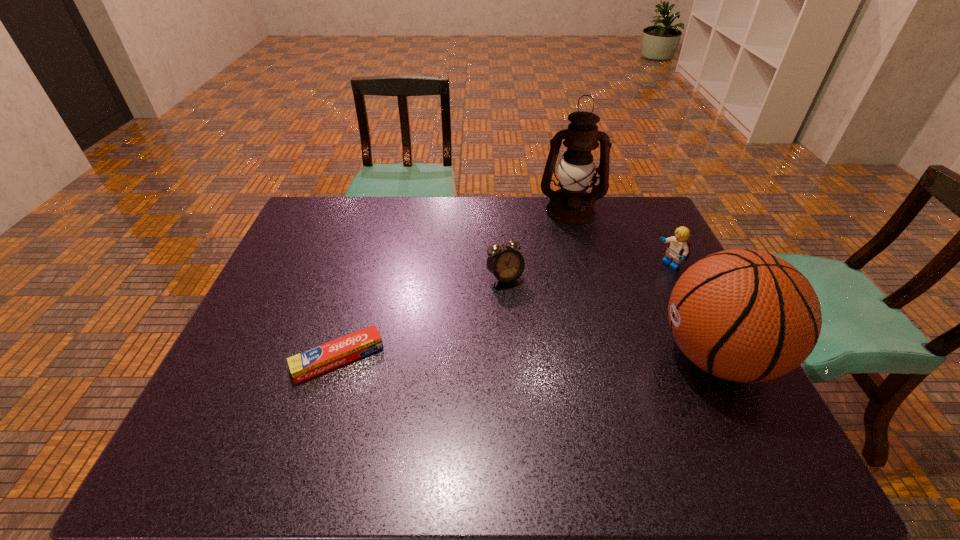
At what (x,y) coordinates should I click in order to perform the action: click on vacant region at the far left corner of the desktop. Please return your answer as a coordinate pair (x, y). The image size is (960, 540). Looking at the image, I should click on (323, 200).

The width and height of the screenshot is (960, 540). Identify the location of unoccupied position between the shortest object and the Lego. (503, 311).

Where is `free area in between the leftmost object and the Lego`? The image size is (960, 540). free area in between the leftmost object and the Lego is located at coordinates (503, 311).

Where is `empty location between the shortest object and the fourth object from right to left`? This screenshot has height=540, width=960. empty location between the shortest object and the fourth object from right to left is located at coordinates (421, 318).

Locate an element on the screen. The width and height of the screenshot is (960, 540). free spot between the fourth shortest object and the fourth object from right to left is located at coordinates (611, 317).

Locate an element on the screen. vacant area that lies between the shortest object and the Lego is located at coordinates (503, 311).

The height and width of the screenshot is (540, 960). Find the location of `empty space between the lantern and the Lego`. empty space between the lantern and the Lego is located at coordinates tap(619, 238).

The image size is (960, 540). I want to click on vacant space in between the alarm clock and the basketball, so click(x=611, y=317).

The width and height of the screenshot is (960, 540). In order to click on vacant area between the Lego and the lantern in this screenshot , I will do `click(619, 238)`.

Where is `free space that is in between the lantern and the alarm clock`? This screenshot has width=960, height=540. free space that is in between the lantern and the alarm clock is located at coordinates (538, 245).